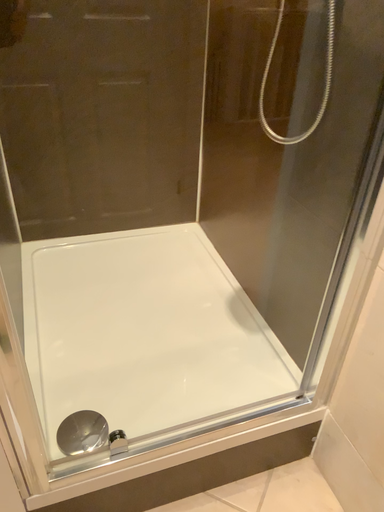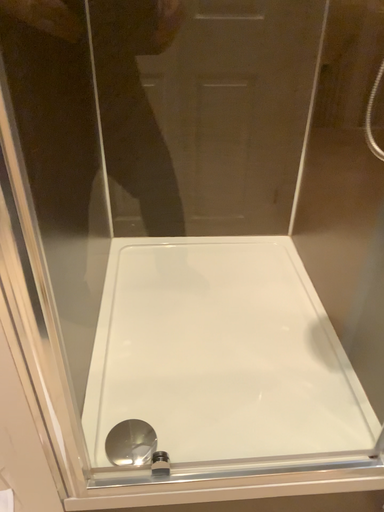
Question: Which way did the camera rotate in the video?

Choices:
 (A) rotated right
 (B) rotated left

Answer: (B)